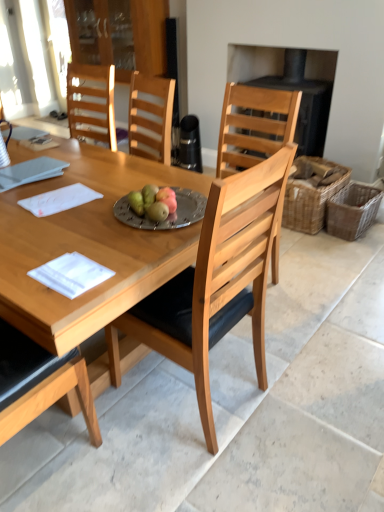
Identify the location of spots to the right of white paper at center, the third notepad from the top. (127, 266).